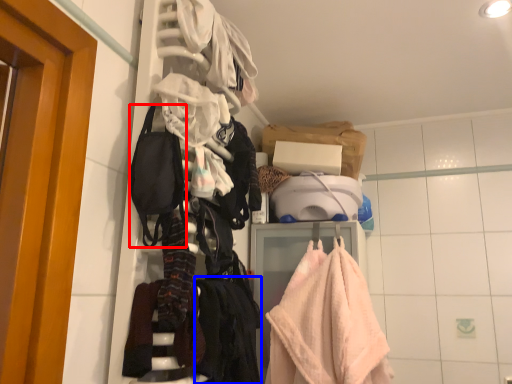
Question: Among these objects, which one is nearest to the camera, accessory (highlighted by a red box) or clothing (highlighted by a blue box)?

Choices:
 (A) accessory
 (B) clothing

Answer: (A)